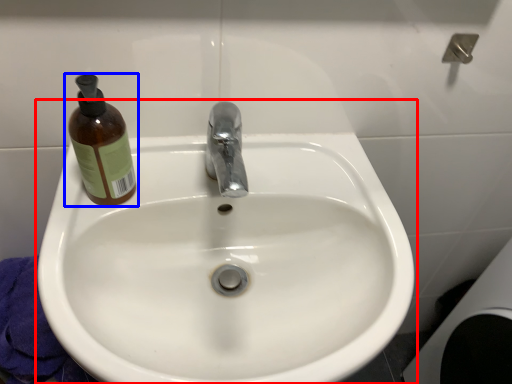
Question: Which object appears farthest to the camera in this image, sink (highlighted by a red box) or bottle (highlighted by a blue box)?

Choices:
 (A) sink
 (B) bottle

Answer: (B)